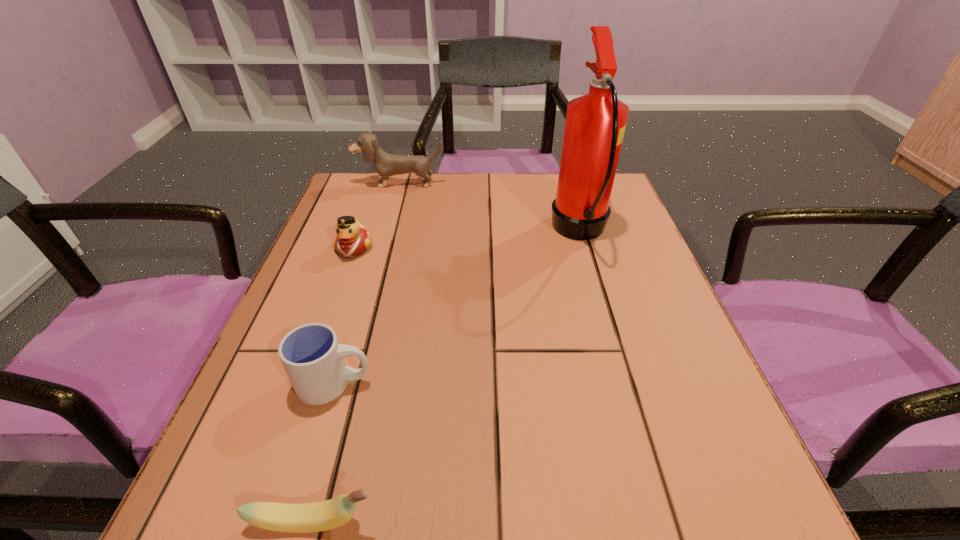
Identify the location of free space at the near right corner of the desktop. (636, 476).

Where is `vacant space that's between the banana and the cup`? vacant space that's between the banana and the cup is located at coordinates (324, 453).

Identify the location of empty space that is in between the rightmost object and the second tallest object. This screenshot has height=540, width=960. (490, 207).

Find the location of `vacant area that lies between the cup and the duck`. vacant area that lies between the cup and the duck is located at coordinates (344, 316).

I want to click on free space between the puppy and the tallest object, so click(x=490, y=207).

Identify the location of vacant area between the cup and the duck. Image resolution: width=960 pixels, height=540 pixels. (344, 316).

The width and height of the screenshot is (960, 540). Find the location of `free space that is in between the banana and the rightmost object`. free space that is in between the banana and the rightmost object is located at coordinates (446, 377).

Identify the location of vacant space that's between the fourth shortest object and the fire extinguisher. The height and width of the screenshot is (540, 960). click(490, 207).

Locate an element on the screen. unoccupied area between the puppy and the duck is located at coordinates (376, 215).

At what (x,y) coordinates should I click in order to perform the action: click on free space that is in between the duck and the rightmost object. Please return your answer as a coordinate pair (x, y). Looking at the image, I should click on (467, 240).